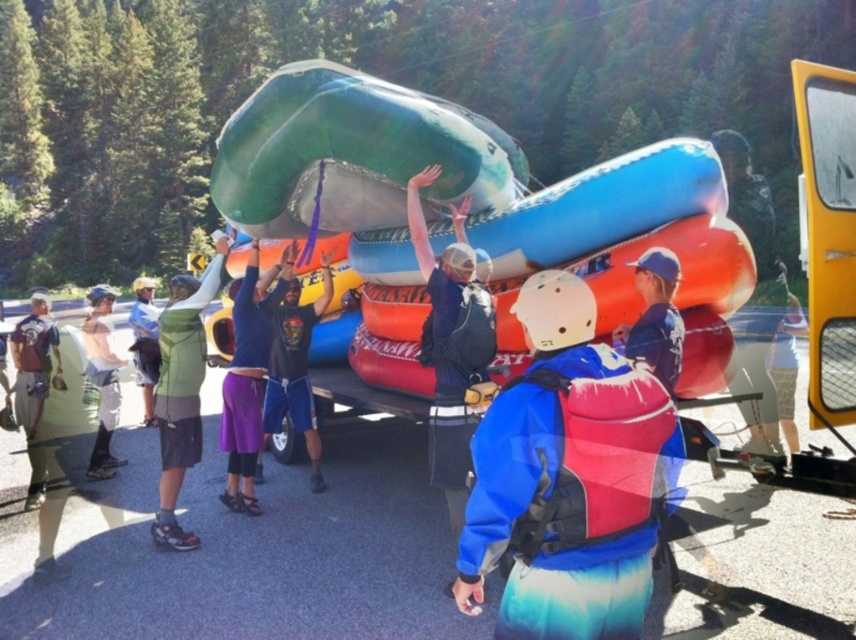
You are standing at the origin point in the image. Which of the two points, point (186, 396) or point (100, 384), is closer to you?

Point (100, 384) is closer to you because it is behind point (186, 396).